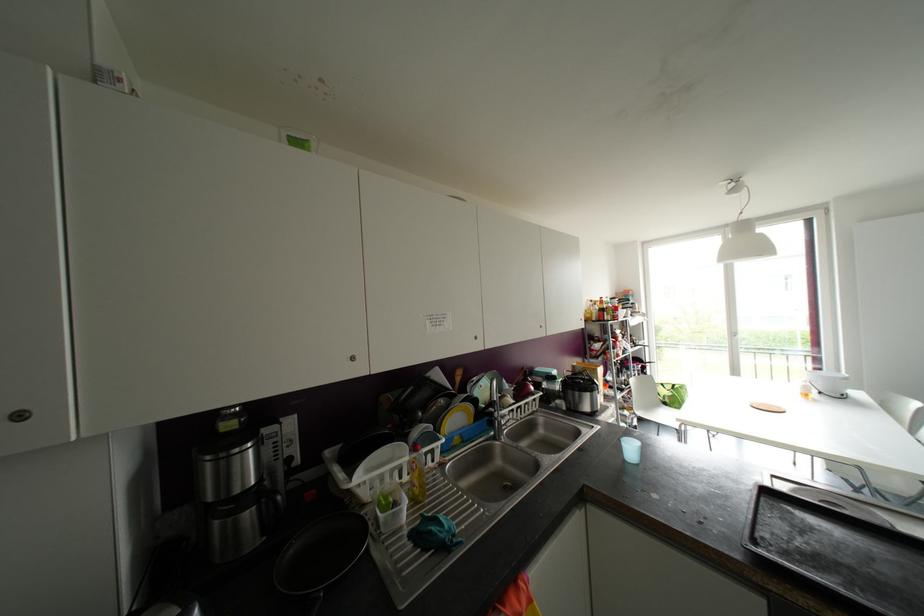
Find the location of a particular element. The height and width of the screenshot is (616, 924). chair sitting surface is located at coordinates (664, 416).